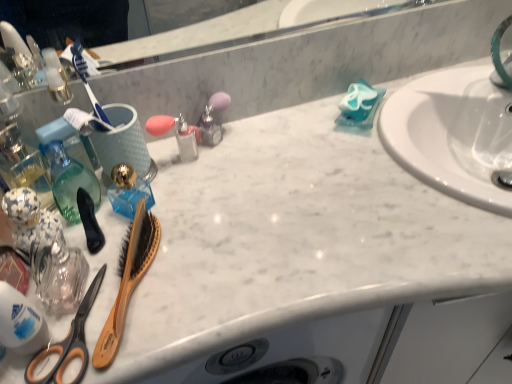
Where is `free point behind wooden bristle brush at left, the first brush when ordered from right to left`? The image size is (512, 384). free point behind wooden bristle brush at left, the first brush when ordered from right to left is located at coordinates (166, 205).